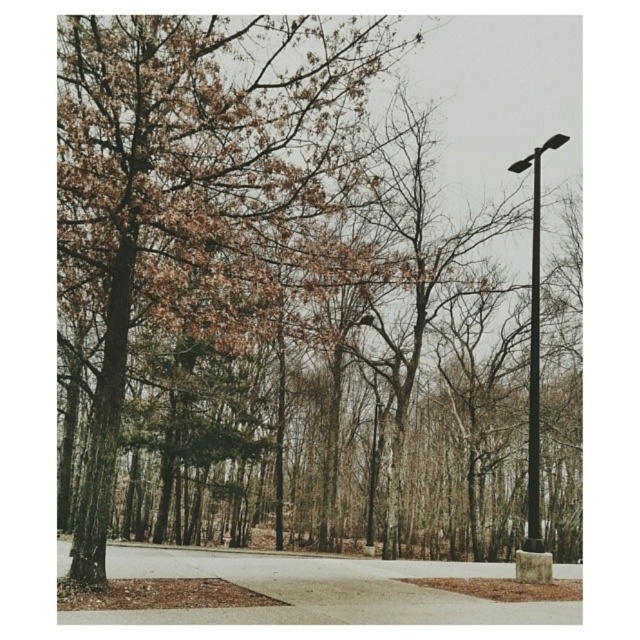
Question: Is black metal street light at right smaller than smooth black pole at center?

Choices:
 (A) no
 (B) yes

Answer: (A)

Question: Which object appears closest to the camera in this image?

Choices:
 (A) brown wood tree at center
 (B) smooth black pole at center

Answer: (A)

Question: Does black metal street light at right appear under smooth black pole at center?

Choices:
 (A) yes
 (B) no

Answer: (B)

Question: Which object is positioned farthest from the black metal street light at right?

Choices:
 (A) smooth black pole at center
 (B) brown wood tree at center

Answer: (B)

Question: Is black metal street light at right smaller than black metal pole at right?

Choices:
 (A) yes
 (B) no

Answer: (B)

Question: Which object is positioned closest to the smooth black pole at center?

Choices:
 (A) black metal street light at right
 (B) black metal pole at right

Answer: (B)